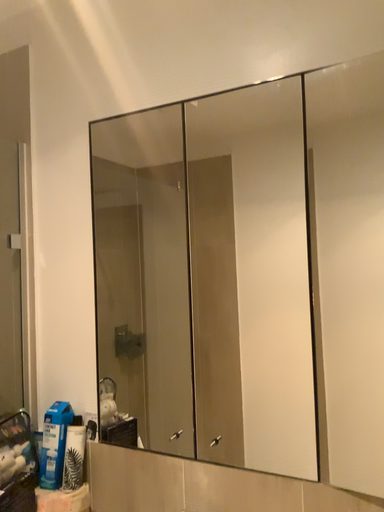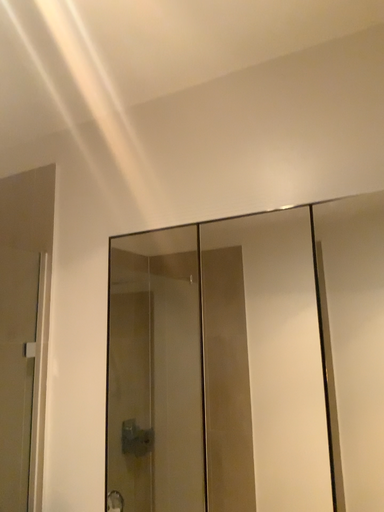
Question: How did the camera likely rotate when shooting the video?

Choices:
 (A) rotated downward
 (B) rotated upward

Answer: (B)